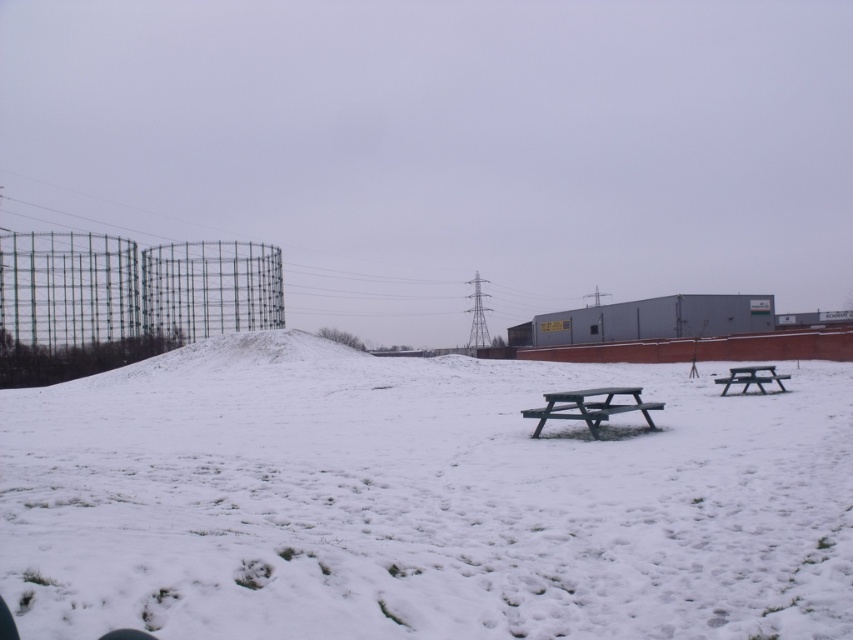
Question: Based on their relative distances, which object is nearer to the white powdery snow at center?

Choices:
 (A) wooden picnic table at right
 (B) green plastic picnic table at center

Answer: (B)

Question: Which is nearer to the green plastic picnic table at center?

Choices:
 (A) wooden picnic table at right
 (B) white powdery snow at center

Answer: (B)

Question: Is white powdery snow at center positioned at the back of green plastic picnic table at center?

Choices:
 (A) no
 (B) yes

Answer: (A)

Question: Can you confirm if white powdery snow at center is thinner than wooden picnic table at right?

Choices:
 (A) yes
 (B) no

Answer: (B)

Question: Which of the following is the farthest from the observer?

Choices:
 (A) wooden picnic table at right
 (B) white powdery snow at center

Answer: (A)

Question: Is white powdery snow at center in front of green plastic picnic table at center?

Choices:
 (A) no
 (B) yes

Answer: (B)